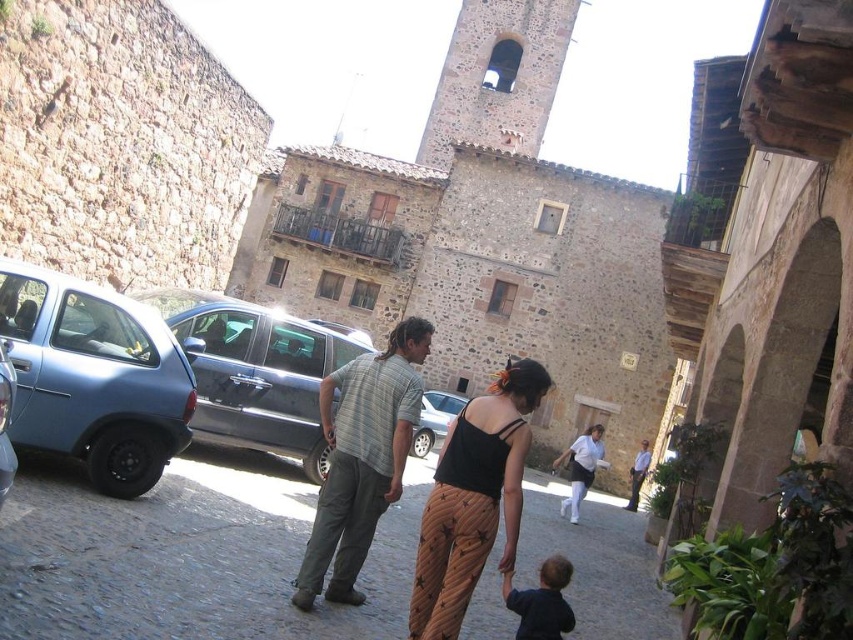
You are standing on the cobblestone street in the historic town and see two points marked on the ground. The first point is at coordinate point (155, 396) and the second is at point (4, 388). Which point is closer to you?

Point (155, 396) is closer to you because it is further to the viewer than point (4, 388).